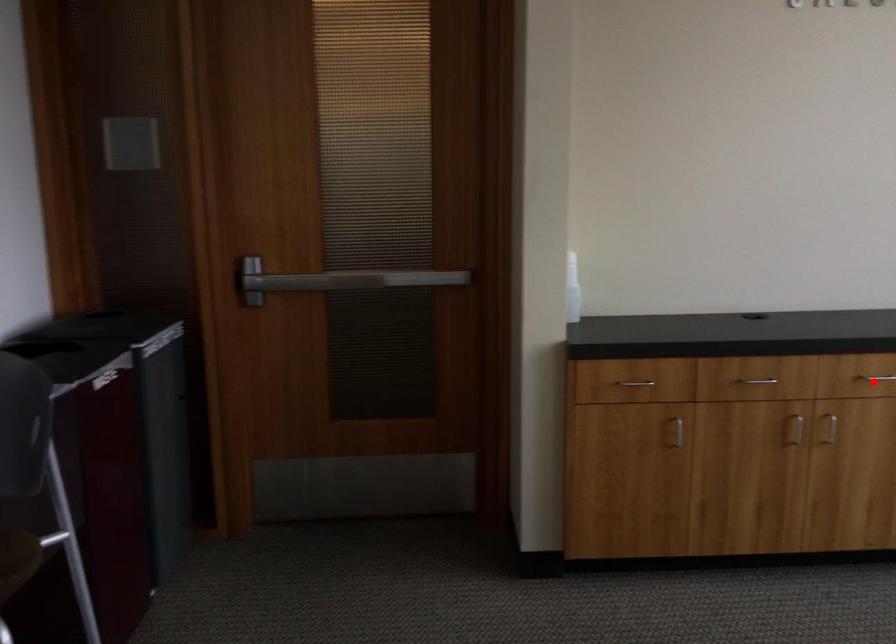
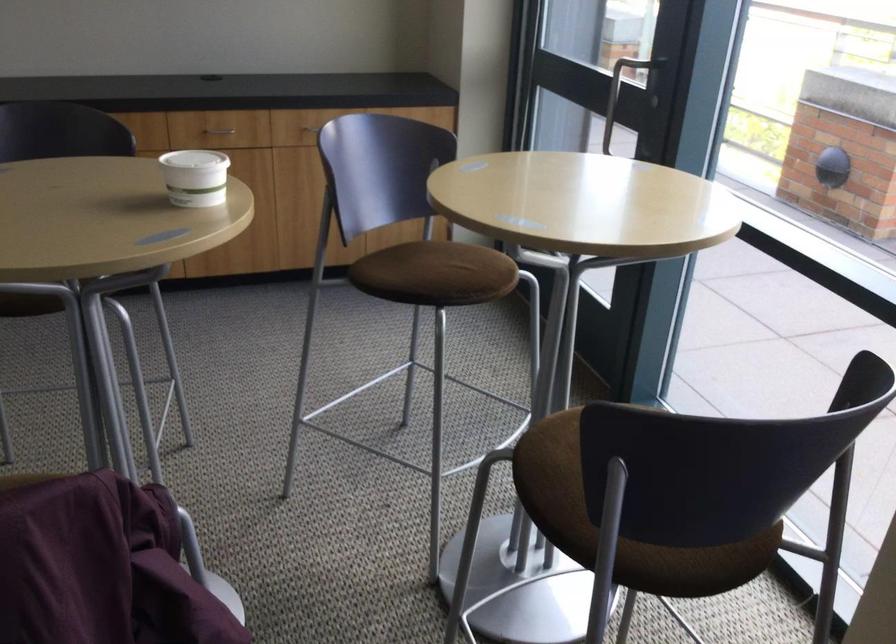
Question: I am providing you with two images of the same scene from different viewpoints. A red point is marked on the first image. At the location where the point appears in image 1, is it still visible in image 2?

Choices:
 (A) Yes
 (B) No

Answer: (B)